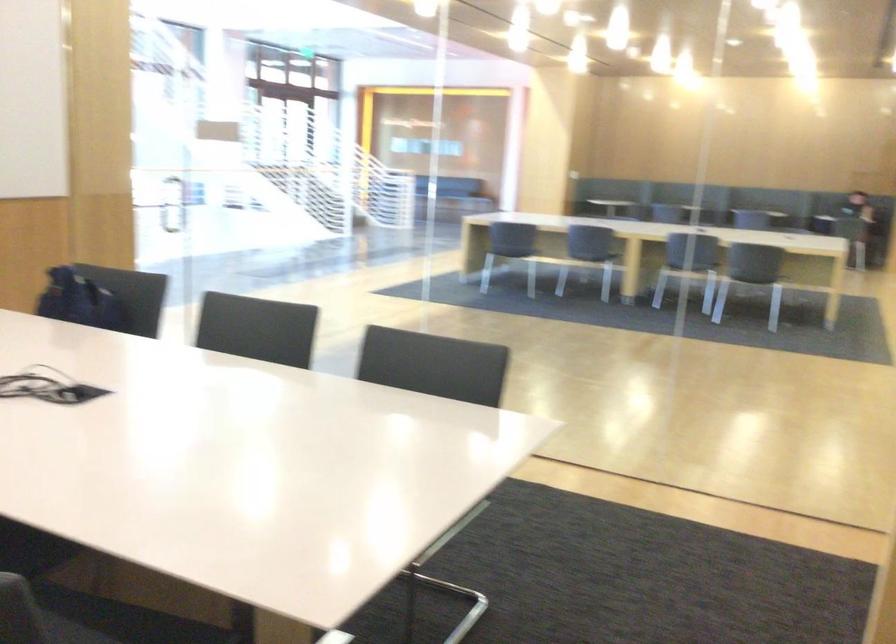
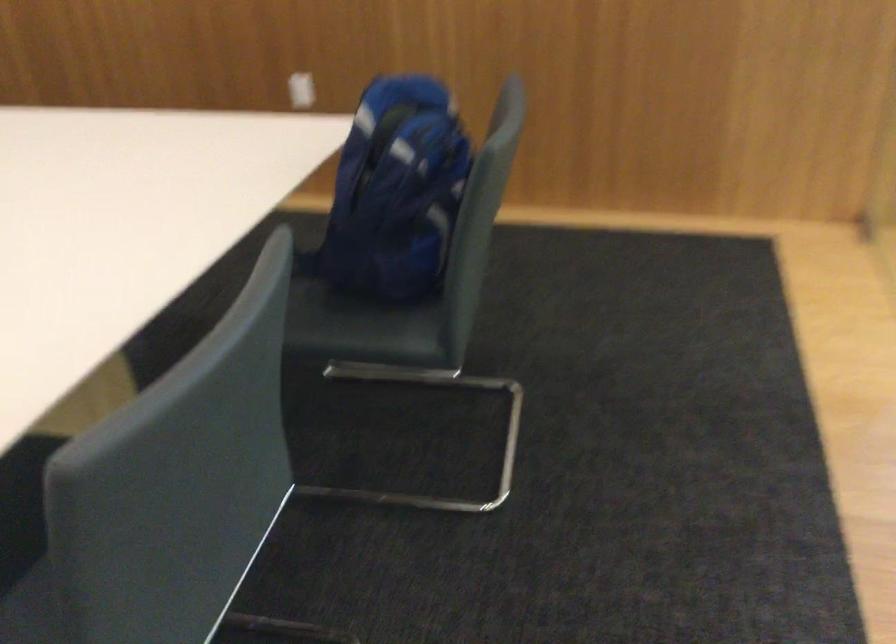
The point at (100,310) is marked in the first image. Where is the corresponding point in the second image?

(395, 192)